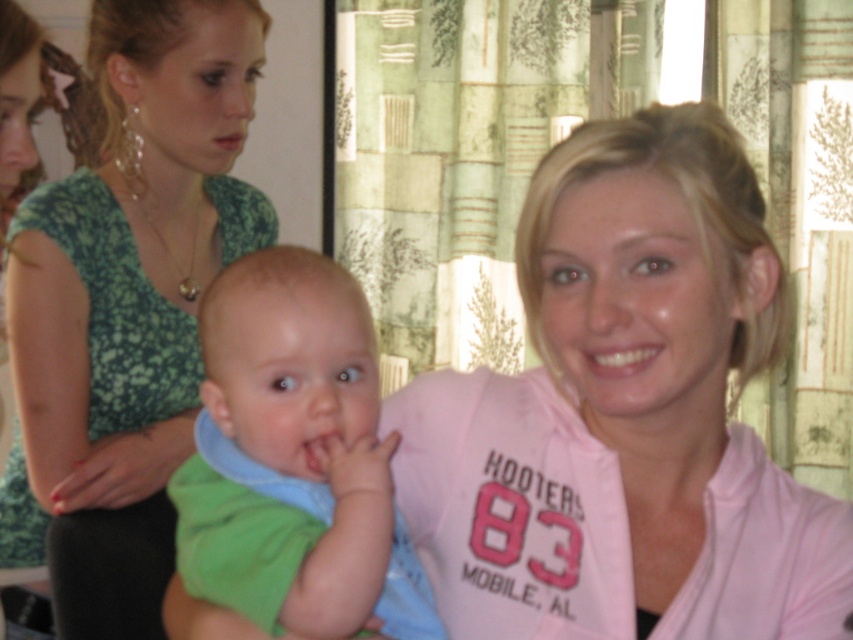
Looking at this image, you are a photographer trying to capture a closeup of the green soft fabric baby at center. However, the green floral dress at upper left is blocking your view. Can you adjust your position to see the baby without moving any objects?

The green floral dress at upper left is above the green soft fabric baby at center, so you can lower your camera angle to avoid the dress and still see the baby.

You are a photographer setting up a shoot in this scene. You need to place a backdrop that must be wider than both the green floral dress at upper left and the green soft fabric baby at center. According to the scene description, which object determines the minimum width required for the backdrop?

The green floral dress at upper left is wider than the green soft fabric baby at center, so the backdrop must be wider than the green floral dress at upper left to accommodate both objects.

You are a photographer trying to capture a photo of the green soft fabric baby at center and the green floral dress at upper left. Which object is located to the left of the other?

The green floral dress at upper left is positioned on the left side of green soft fabric baby at center.